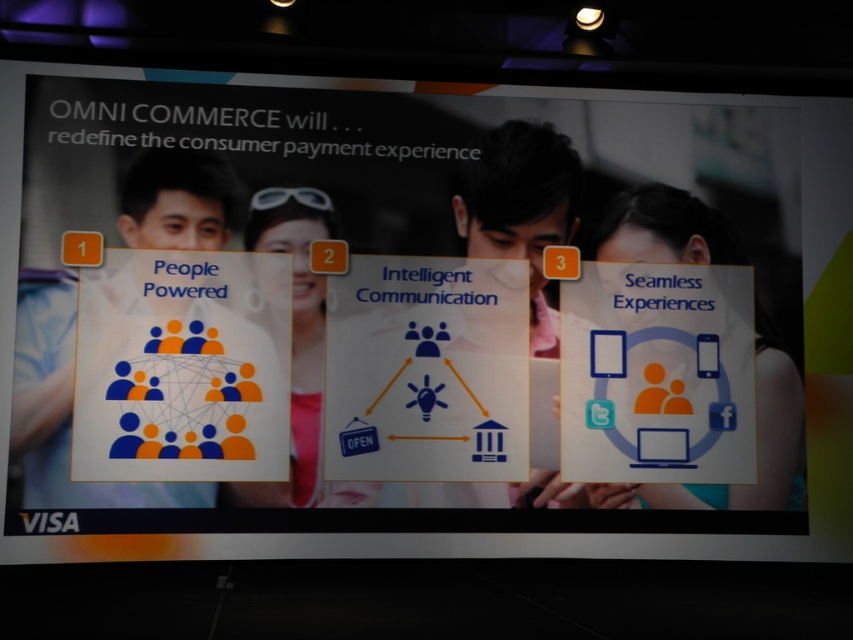
Is blue matte people at left closer to the viewer compared to matte orange figure at center?

Yes.

Is blue matte people at left to the left of matte orange figure at center from the viewer's perspective?

Indeed, blue matte people at left is positioned on the left side of matte orange figure at center.

Is point (21, 353) behind point (286, 188)?

No, it is in front of (286, 188).

Locate an element on the screen. The image size is (853, 640). blue matte people at left is located at coordinates (62, 406).

Which is more to the right, blue matte people at left or matte black man at center?

matte black man at center

Measure the distance between blue matte people at left and camera.

A distance of 5.27 meters exists between blue matte people at left and camera.

Find the location of a particular element. blue matte people at left is located at coordinates (62, 406).

Who is more forward, [26,381] or [704,234]?

Point [26,381] is in front.

Who is shorter, blue matte people at left or matte orange woman at center?

Standing shorter between the two is matte orange woman at center.

Does point (138, 202) come closer to viewer compared to point (792, 372)?

Yes, point (138, 202) is in front of point (792, 372).

The height and width of the screenshot is (640, 853). What are the coordinates of `blue matte people at left` in the screenshot? It's located at (62, 406).